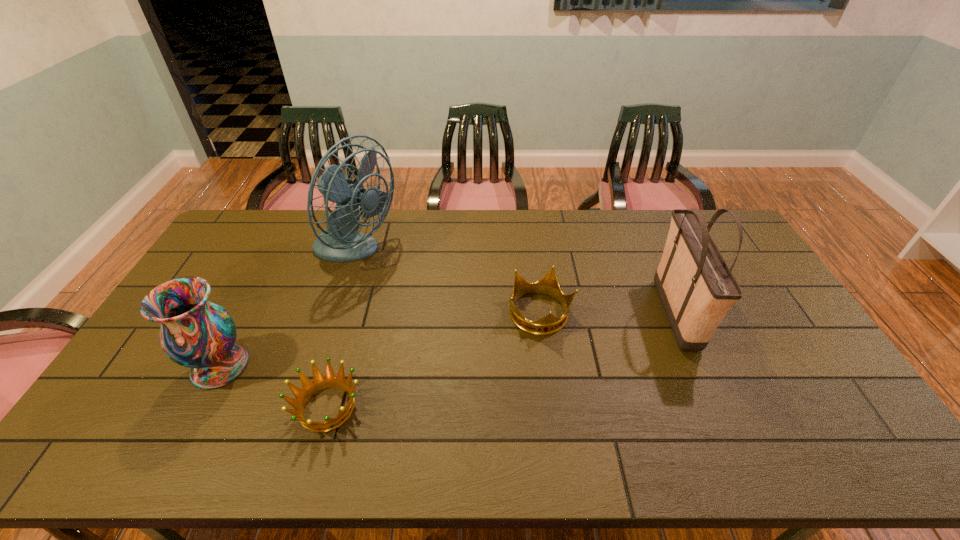
Where is `free space located on the back of the rightmost object`? Image resolution: width=960 pixels, height=540 pixels. free space located on the back of the rightmost object is located at coordinates (633, 216).

Find the location of `vacant position located on the back of the leftmost object`. vacant position located on the back of the leftmost object is located at coordinates (256, 296).

The width and height of the screenshot is (960, 540). What are the coordinates of `free space located on the right of the right crown` in the screenshot? It's located at (634, 314).

Image resolution: width=960 pixels, height=540 pixels. I want to click on free region located 0.390m on the left of the shortest object, so click(139, 408).

I want to click on object at the far edge, so 340,242.

Image resolution: width=960 pixels, height=540 pixels. What are the coordinates of `object located at the near edge` in the screenshot? It's located at (319, 383).

The height and width of the screenshot is (540, 960). I want to click on object that is at the left edge, so click(195, 333).

At what (x,y) coordinates should I click in order to perform the action: click on free region at the far edge. Please return your answer as a coordinate pair (x, y). This screenshot has height=540, width=960. Looking at the image, I should click on (411, 217).

I want to click on vacant space at the near edge, so click(x=283, y=462).

The width and height of the screenshot is (960, 540). In the image, there is a desktop. In order to click on free space at the right edge in this screenshot , I will do `click(745, 274)`.